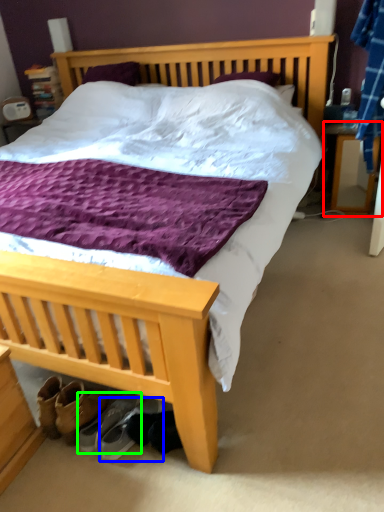
Question: Which object is positioned closest to nightstand (highlighted by a red box)? Select from footwear (highlighted by a blue box) and footwear (highlighted by a green box).

Choices:
 (A) footwear
 (B) footwear

Answer: (A)